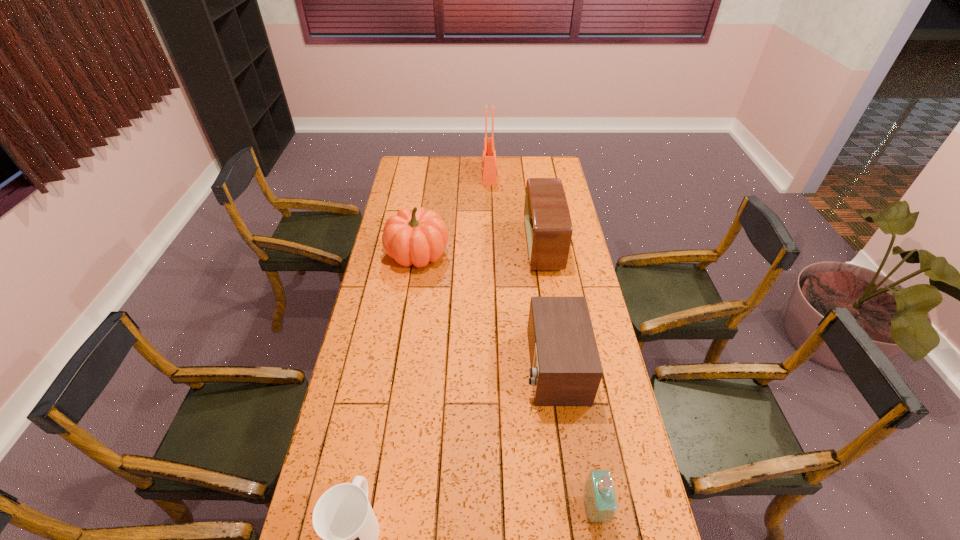
The image size is (960, 540). I want to click on vacant space located on the front-facing side of the taller radio receiver, so click(457, 246).

Find the location of a particular element. This screenshot has width=960, height=540. vacant area situated 0.190m on the front-facing side of the taller radio receiver is located at coordinates (483, 246).

This screenshot has height=540, width=960. I want to click on vacant space situated 0.380m on the front-facing side of the taller radio receiver, so click(x=439, y=246).

You are a GUI agent. You are given a task and a screenshot of the screen. Output one action in this format:
    pyautogui.click(x=<x>, y=<y>)
    Task: Click on the vacant space situated 0.220m on the back of the pumpkin
    The height and width of the screenshot is (540, 960).
    Given the screenshot: What is the action you would take?
    pyautogui.click(x=425, y=206)

Where is `free region located on the front-facing side of the fourth farthest object`? The width and height of the screenshot is (960, 540). free region located on the front-facing side of the fourth farthest object is located at coordinates (501, 366).

You are a GUI agent. You are given a task and a screenshot of the screen. Output one action in this format:
    pyautogui.click(x=<x>, y=<y>)
    Task: Click on the free region located on the front-facing side of the fourth farthest object
    The height and width of the screenshot is (540, 960).
    Given the screenshot: What is the action you would take?
    pyautogui.click(x=412, y=366)

Image resolution: width=960 pixels, height=540 pixels. What are the coordinates of `vacant space located on the front-facing side of the fourth farthest object` in the screenshot? It's located at (477, 366).

The height and width of the screenshot is (540, 960). Find the location of `vacant space located 0.140m on the front label of the perfume`. vacant space located 0.140m on the front label of the perfume is located at coordinates (530, 508).

Image resolution: width=960 pixels, height=540 pixels. I want to click on vacant space positioned on the front label of the perfume, so coord(492,508).

This screenshot has height=540, width=960. What are the coordinates of `free region located 0.080m on the front label of the perfume` in the screenshot? It's located at (553, 508).